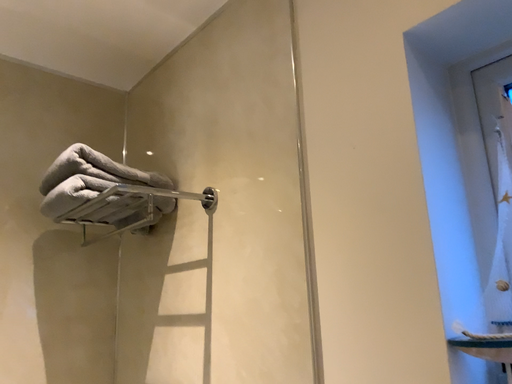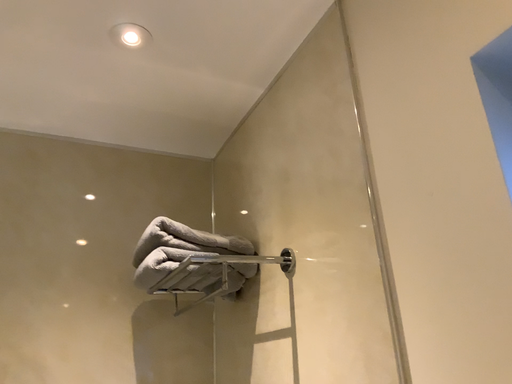
Question: How did the camera likely rotate when shooting the video?

Choices:
 (A) rotated right
 (B) rotated left

Answer: (B)